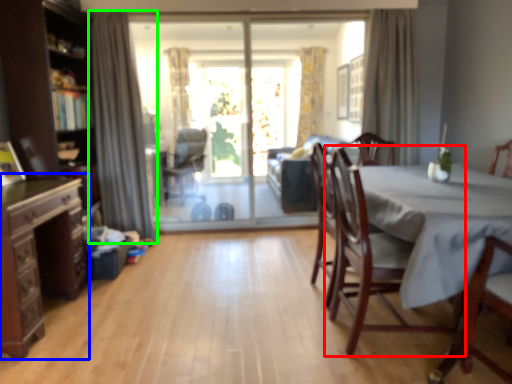
Question: Which is nearer to the chair (highlighted by a red box)? dresser (highlighted by a blue box) or curtain (highlighted by a green box).

Choices:
 (A) dresser
 (B) curtain

Answer: (A)